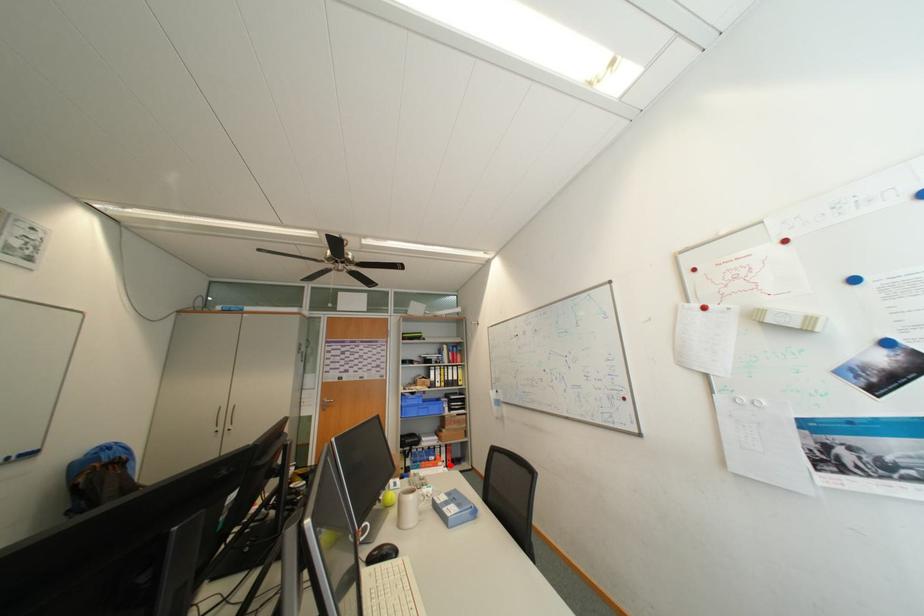
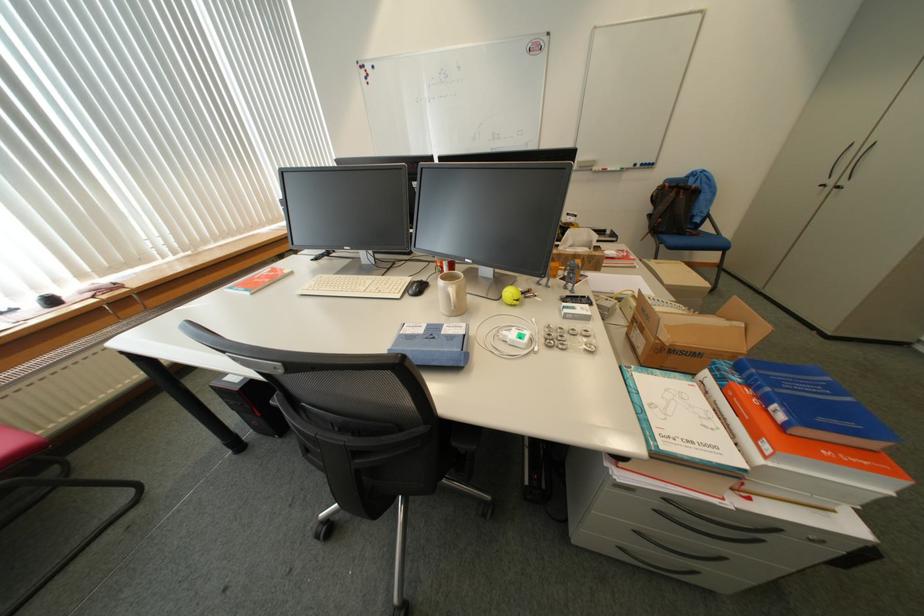
Find the pixel in the second image that matches the highlighted location in the first image.

(775, 448)